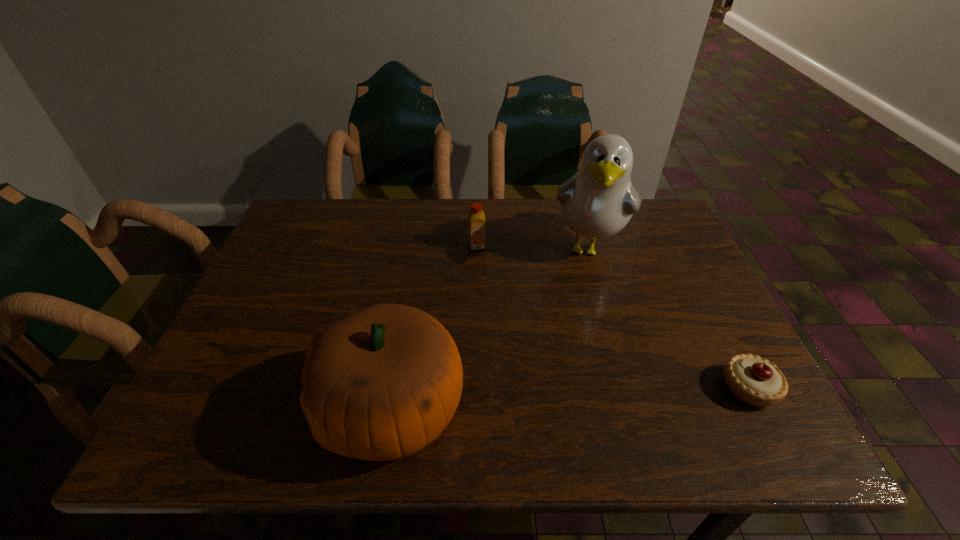
Identify the location of free space located on the beak of the tallest object. (579, 308).

Locate an element on the screen. The height and width of the screenshot is (540, 960). free space located on the beak of the tallest object is located at coordinates (573, 342).

The height and width of the screenshot is (540, 960). I want to click on vacant position located on the beak of the tallest object, so click(581, 299).

Identify the location of orange juice that is at the far edge. This screenshot has width=960, height=540. (476, 220).

You are a GUI agent. You are given a task and a screenshot of the screen. Output one action in this format:
    pyautogui.click(x=<x>, y=<y>)
    Task: Click on the gull present at the far edge
    The width and height of the screenshot is (960, 540).
    Given the screenshot: What is the action you would take?
    pyautogui.click(x=597, y=202)

What are the coordinates of `pumpkin at the near edge` in the screenshot? It's located at (380, 384).

This screenshot has width=960, height=540. In order to click on pastry at the near edge in this screenshot , I will do `click(754, 380)`.

The height and width of the screenshot is (540, 960). Find the location of `object that is at the right edge`. object that is at the right edge is located at coordinates (754, 380).

Locate an element on the screen. Image resolution: width=960 pixels, height=540 pixels. object that is at the near right corner is located at coordinates (754, 380).

The image size is (960, 540). Find the location of `free space at the far edge of the desktop`. free space at the far edge of the desktop is located at coordinates (352, 219).